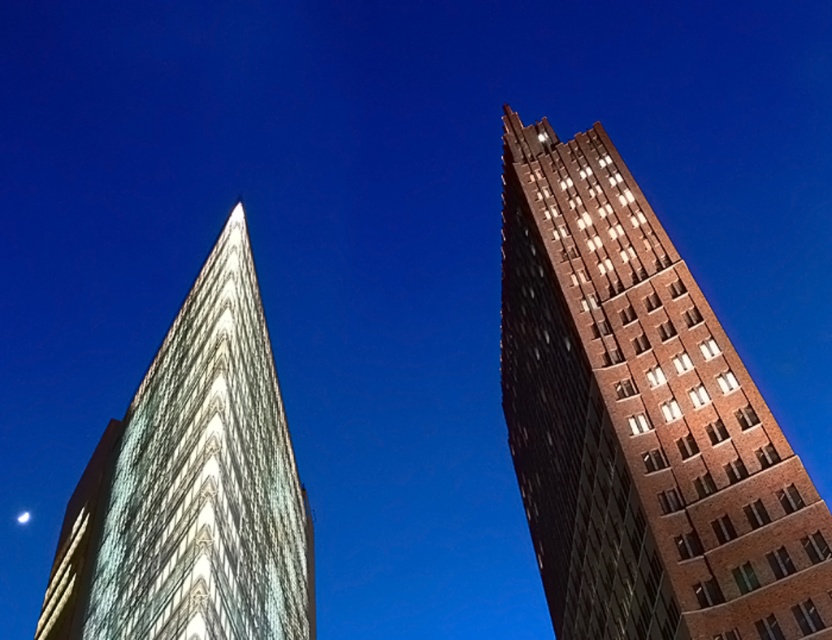
Based on the photo, you are standing in front of the two buildings and want to take a photo that includes both the brown brick building at upper right and the white glass building at left. Which building should you move closer to in order to frame both in the same shot?

You should move closer to the brown brick building at upper right because it is closer to the viewer than the white glass building at left, so adjusting your position towards it will help include both buildings in the frame.

You are an architect analyzing the layout of the city skyline. You observe the brown brick building at upper right and the white glass building at left. Which building is situated higher in the image?

The brown brick building at upper right is positioned over the white glass building at left, meaning it is higher in the image.